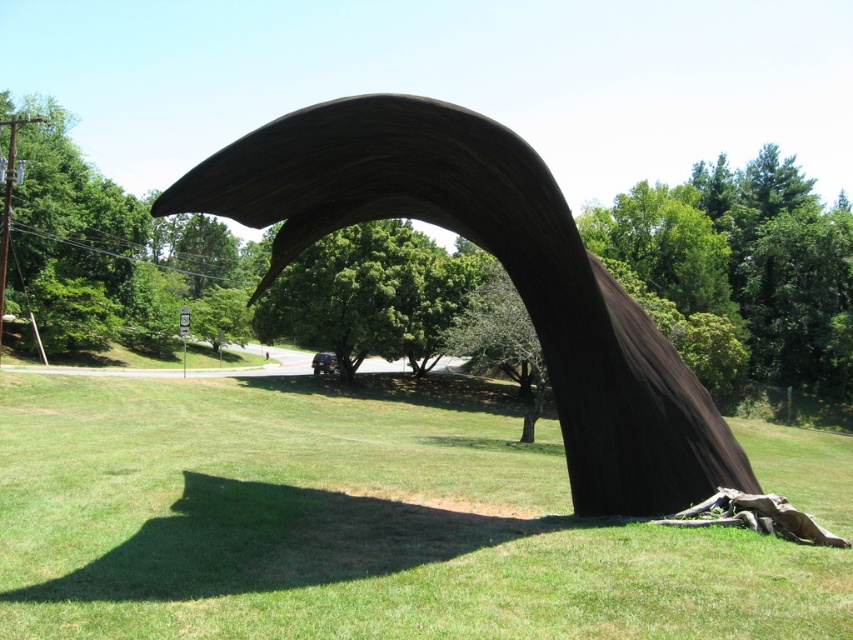
You are planning to place a 2x4 feet wooden bench in this area. Given the green grass at center and the rustic wood arch at center, which location would allow the bench to fit better without overlapping?

The green grass at center has a larger width than the rustic wood arch at center, so placing the bench on the green grass at center would provide more space and avoid overlapping with the rustic wood arch at center.

You are standing in front of the sculpture and want to take a photo. You notice two points on the sculpture labeled as point (x=483, y=588) and point (x=212, y=204). Which point is closer to you?

Point (x=483, y=588) is closer to the viewer than point (x=212, y=204).

You are planning to place a new bench that is 1.5 meters long in this outdoor area. Considering the green grass at center and the rustic wood arch at center, which object would allow the bench to fit better in terms of space?

The green grass at center has a larger size compared to the rustic wood arch at center, so placing the bench on the green grass at center would provide more space for the bench to fit comfortably.